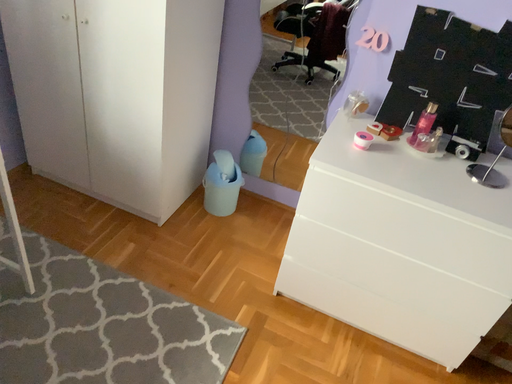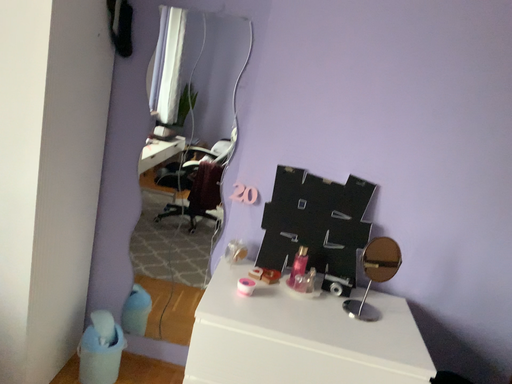
Question: Which way did the camera rotate in the video?

Choices:
 (A) rotated left
 (B) rotated right

Answer: (B)